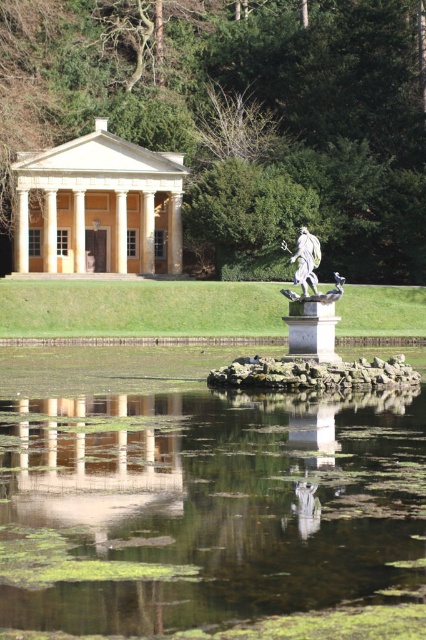
You are standing in front of the pavilion and want to walk to the white marble statue at center. Is the green algae water at center between you and the statue?

The green algae water at center is located below the white marble statue at center, so the statue is positioned above the water. Since you are standing in front of the pavilion, the statue is likely in front of you, but the water is not between you and the statue because it is below the statue, not in front of it.